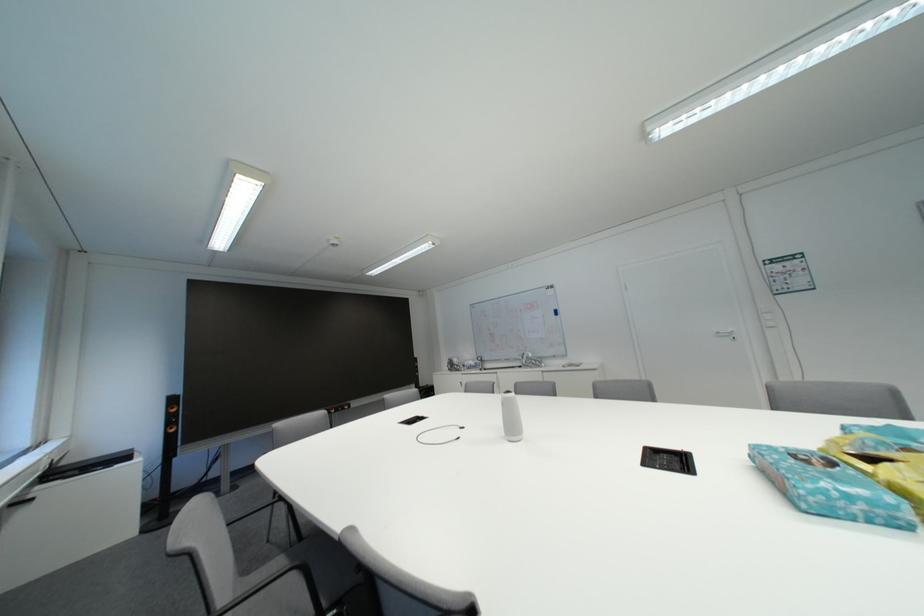
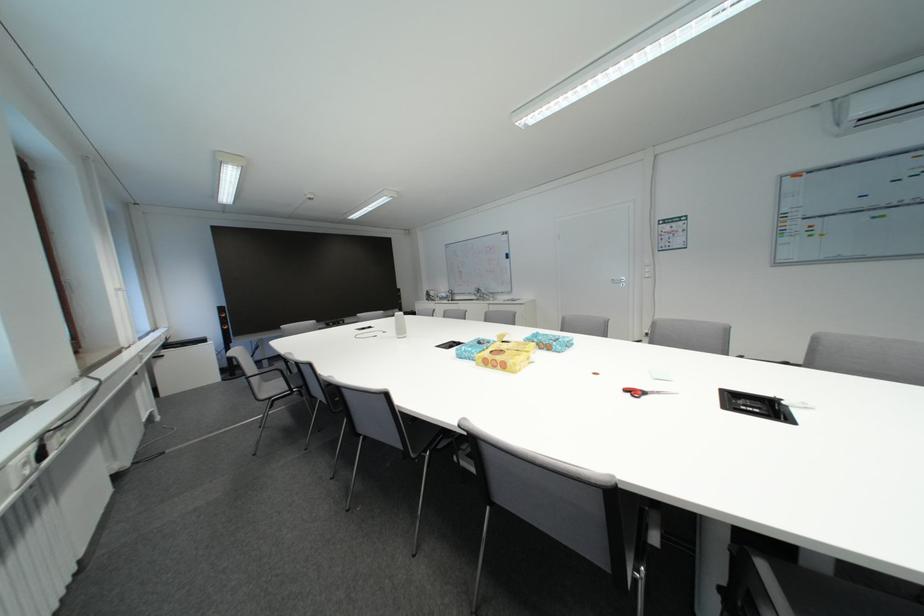
Locate, in the second image, the point that corresponds to (x=858, y=500) in the first image.

(476, 354)